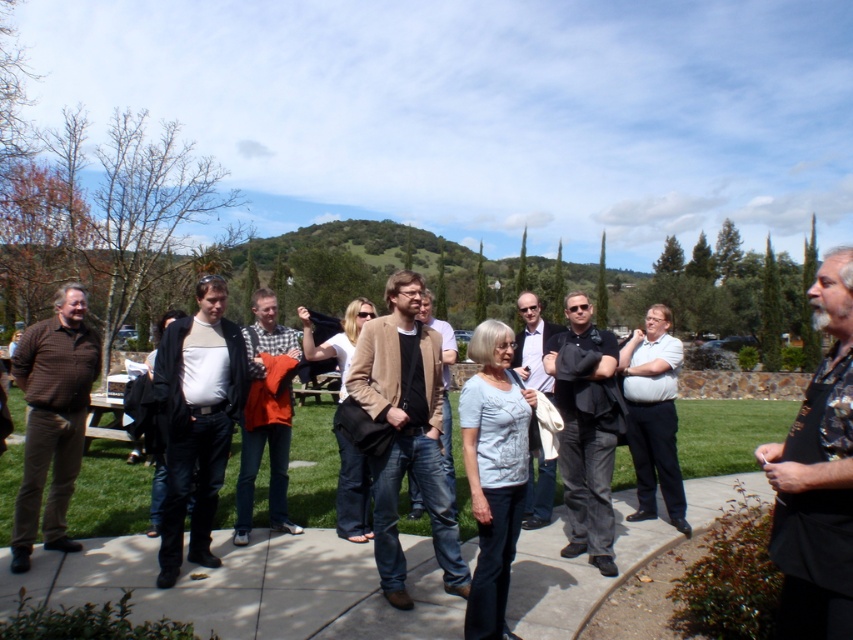
You are a photographer trying to capture a group photo of the matte black jacket at center and the tan leather jacket at center. The camera you are using has a minimum focus distance of 3 feet. Can you take a photo of both jackets at the same time without moving any of them?

The distance between the matte black jacket at center and the tan leather jacket at center is 3.63 feet, which is greater than the camera minimum focus distance of 3 feet. Therefore, you can take a photo of both jackets at the same time without moving them.